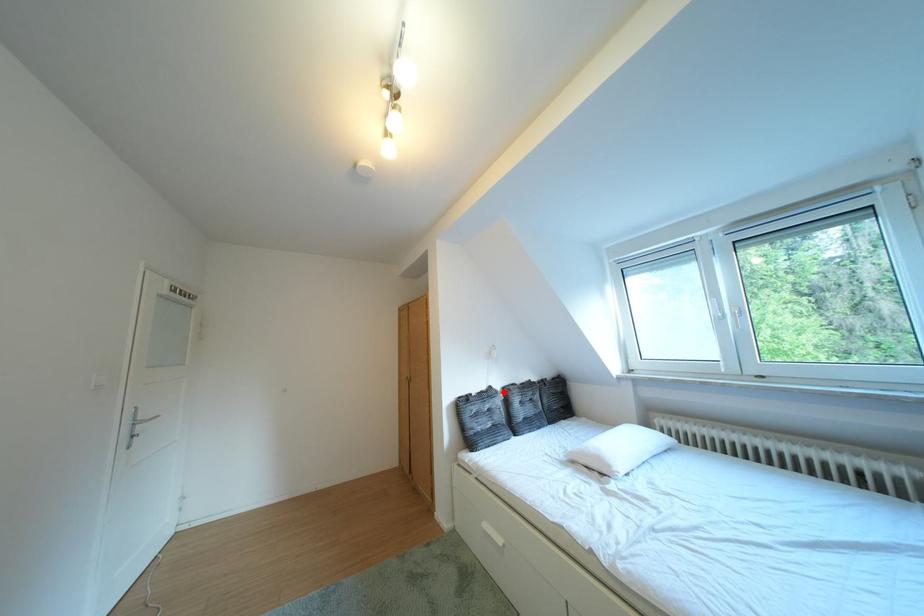
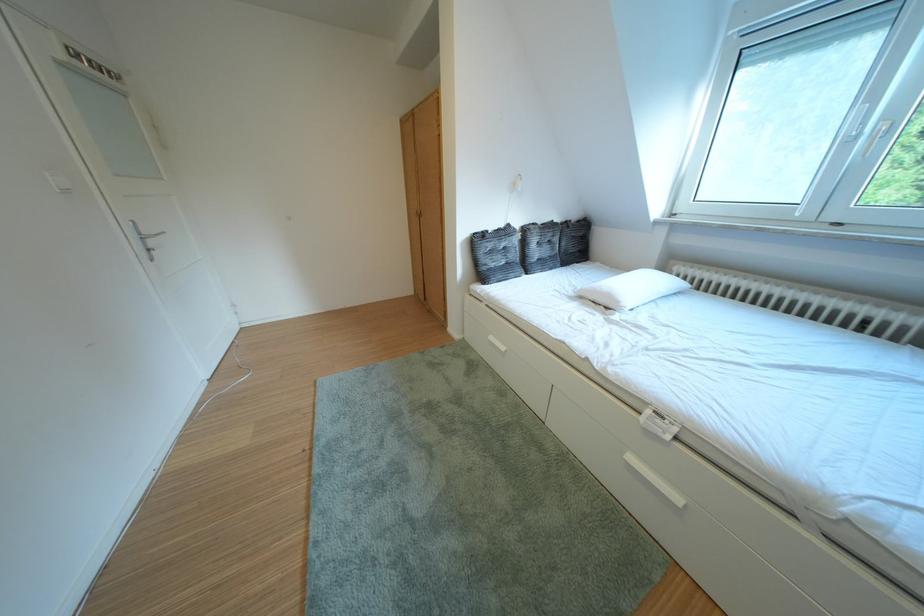
Question: I am providing you with two images of the same scene from different viewpoints. Image1 has a red point marked. In image2, the corresponding 3D location appears at what relative position? Reply with the corresponding letter.

Choices:
 (A) Closer
 (B) Farther

Answer: (A)